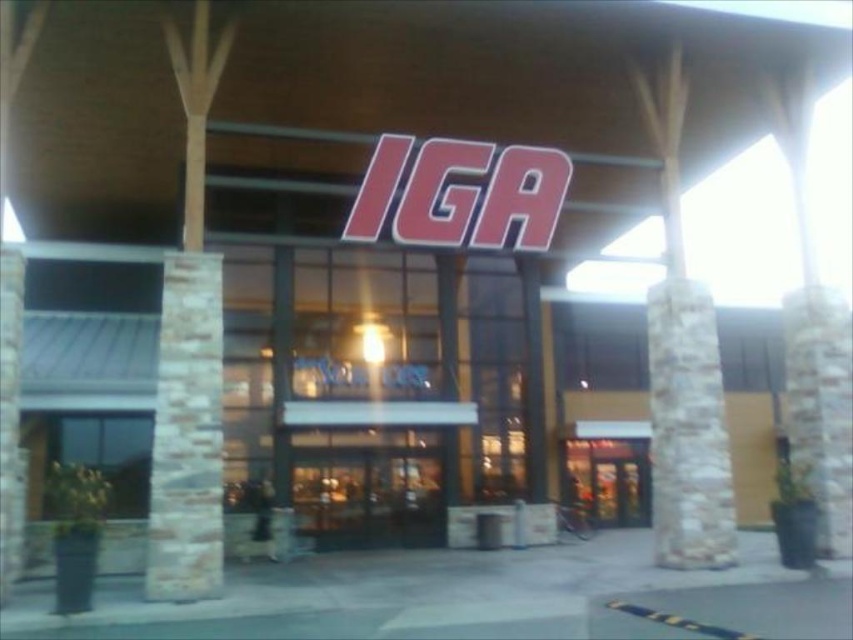
Question: Is glass door at center wider than stone textured pillar at right?

Choices:
 (A) no
 (B) yes

Answer: (B)

Question: Which point is farther to the camera?

Choices:
 (A) (723, 426)
 (B) (606, 468)
 (C) (834, 291)
 (D) (202, 435)

Answer: (B)

Question: Does red plastic sign at center have a greater width compared to stone textured pillar at right?

Choices:
 (A) yes
 (B) no

Answer: (A)

Question: Which point is farther from the camera taking this photo?

Choices:
 (A) (212, 260)
 (B) (784, 308)

Answer: (B)

Question: Which object appears closest to the camera in this image?

Choices:
 (A) metallic glass door at center
 (B) glass door at center
 (C) white stone pillar at center

Answer: (C)

Question: Is stone/textured pillar at left positioned in front of red plastic sign at center?

Choices:
 (A) no
 (B) yes

Answer: (B)